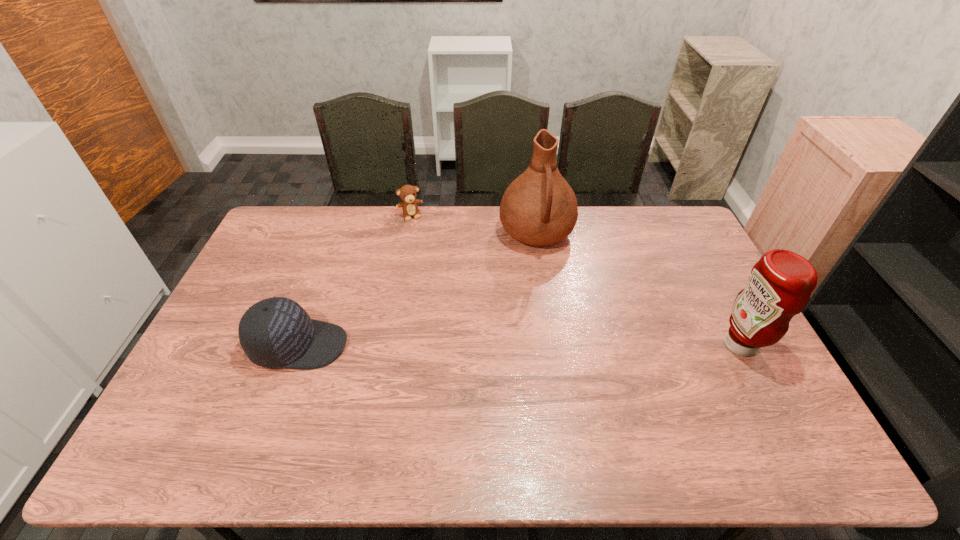
Locate an element on the screen. Image resolution: width=960 pixels, height=540 pixels. free space on the desktop that is between the second shortest object and the condiment and is positioned on the face of the third object from right to left is located at coordinates click(x=463, y=345).

Where is `free space on the desktop that is between the baseball cap and the third shortest object and is positioned on the side of the tallest object with the handle`? free space on the desktop that is between the baseball cap and the third shortest object and is positioned on the side of the tallest object with the handle is located at coordinates (561, 345).